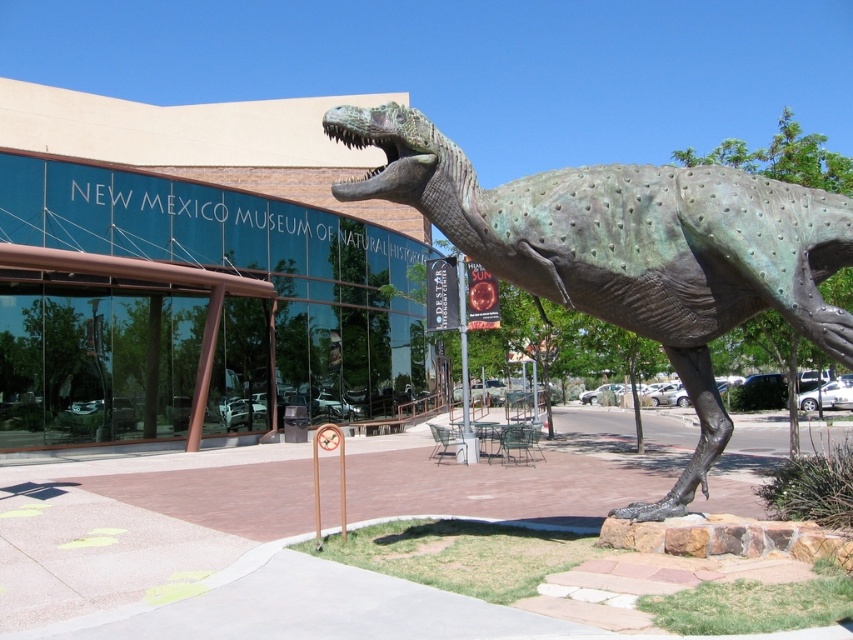
Who is lower down, green metallic dinosaur at right or green polished stone dinosaur at center?

Positioned lower is green polished stone dinosaur at center.

Looking at this image, is green metallic dinosaur at right closer to the viewer compared to green polished stone dinosaur at center?

No, green metallic dinosaur at right is behind green polished stone dinosaur at center.

Identify the location of green metallic dinosaur at right. The height and width of the screenshot is (640, 853). (194, 268).